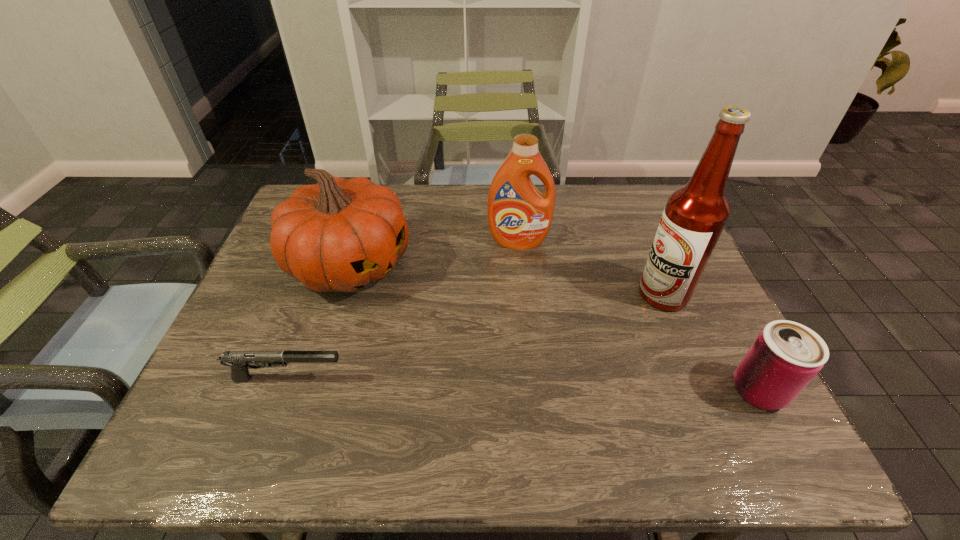
Locate an element on the screen. Image resolution: width=960 pixels, height=540 pixels. free space between the pumpkin and the shortest object is located at coordinates (319, 322).

Locate an element on the screen. Image resolution: width=960 pixels, height=540 pixels. vacant space in between the second tallest object and the alcohol is located at coordinates [x=590, y=268].

Find the location of `free space between the pumpkin and the detergent`. free space between the pumpkin and the detergent is located at coordinates (434, 253).

Locate an element on the screen. object that stands as the second closest to the alcohol is located at coordinates (519, 216).

The width and height of the screenshot is (960, 540). In order to click on object that is the second closest to the can in this screenshot , I will do [519, 216].

This screenshot has height=540, width=960. I want to click on free space that satisfies the following two spatial constraints: 1. on the front side of the alcohol; 2. on the left side of the fourth tallest object, so click(703, 390).

This screenshot has height=540, width=960. In order to click on vacant space that satisfies the following two spatial constraints: 1. on the back side of the pumpkin; 2. on the left side of the third object from right to left in this screenshot , I will do `click(357, 242)`.

Image resolution: width=960 pixels, height=540 pixels. I want to click on vacant space that satisfies the following two spatial constraints: 1. on the back side of the detergent; 2. on the right side of the third tallest object, so click(357, 242).